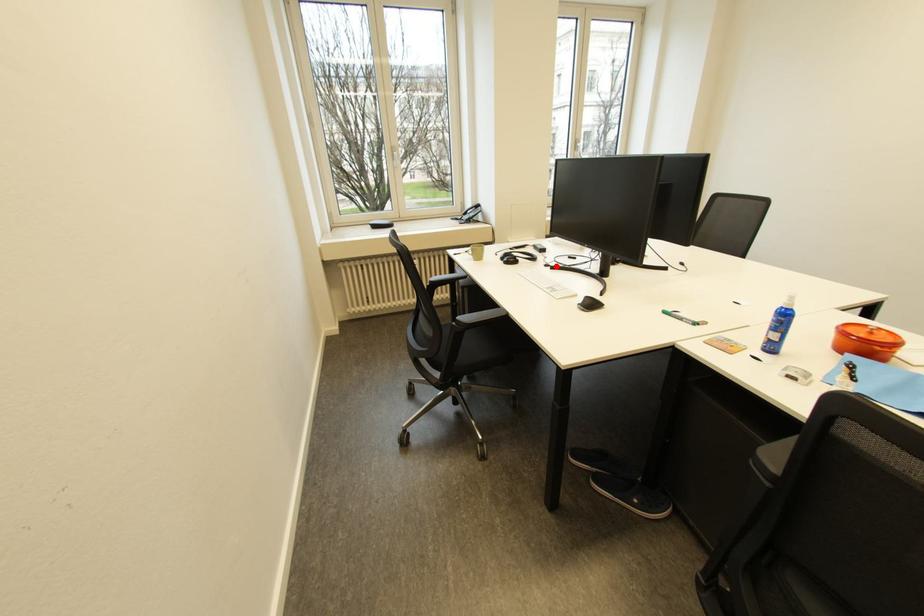
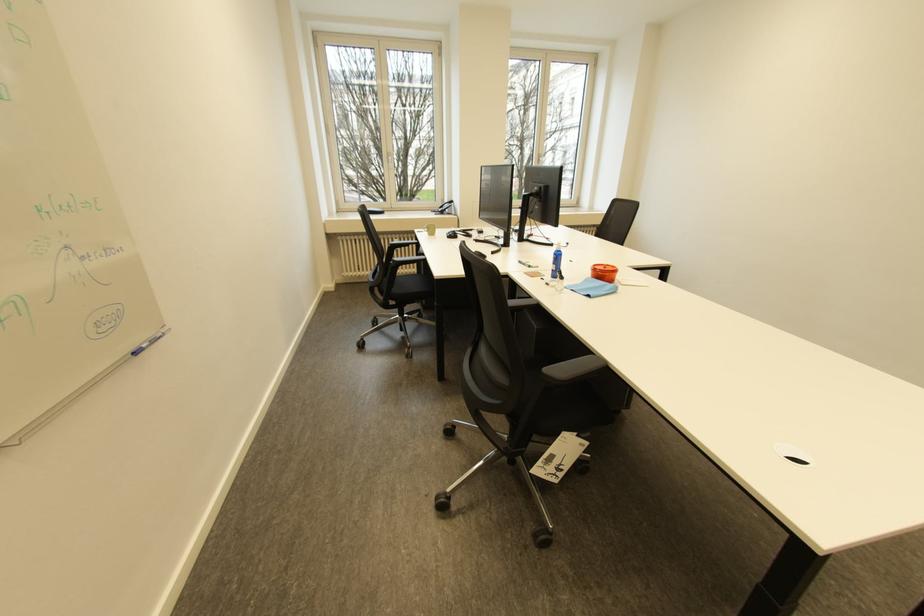
Locate, in the second image, the point that corresponds to the highlighted location in the first image.

(483, 241)